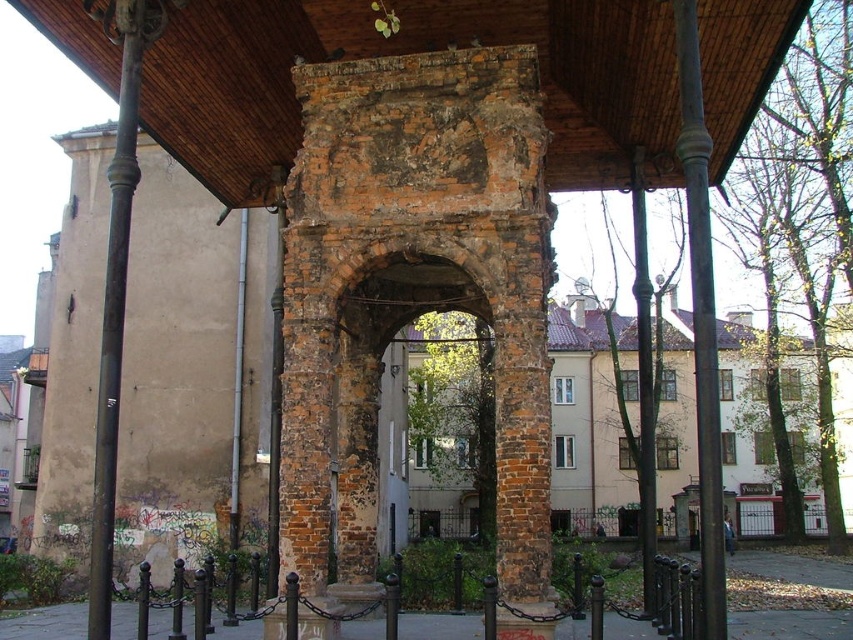
Question: Estimate the real-world distances between objects in this image. Which object is farther from the wooden at center?

Choices:
 (A) green metallic pole at center
 (B) black polished pole at left

Answer: (A)

Question: From the image, what is the correct spatial relationship of wooden at center in relation to green metallic pole at center?

Choices:
 (A) left
 (B) right

Answer: (A)

Question: Which is nearer to the black polished pole at left?

Choices:
 (A) smooth dark brown post at right
 (B) wooden at center
 (C) green metallic pole at center

Answer: (B)

Question: Can you confirm if black polished pole at left is positioned to the right of smooth dark brown post at right?

Choices:
 (A) no
 (B) yes

Answer: (A)

Question: Which point appears closest to the camera in this image?

Choices:
 (A) click(648, 502)
 (B) click(708, 100)

Answer: (B)

Question: Can you confirm if smooth dark brown post at right is bigger than green metallic pole at center?

Choices:
 (A) yes
 (B) no

Answer: (B)